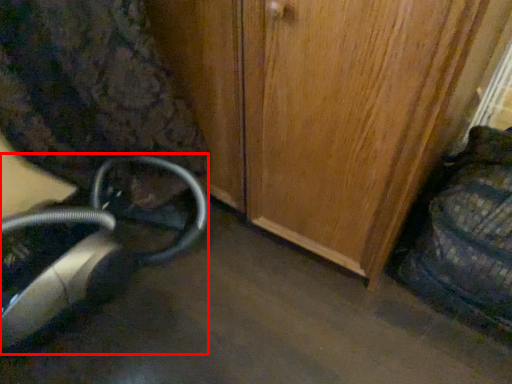
Question: From the image's perspective, where is equipment (annotated by the red box) located relative to swivel chair?

Choices:
 (A) below
 (B) above

Answer: (A)